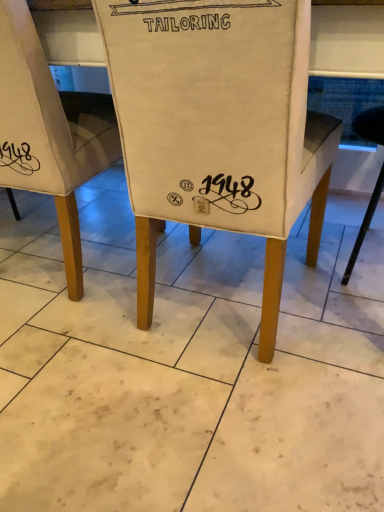
Describe the element at coordinates (49, 132) in the screenshot. The height and width of the screenshot is (512, 384). I see `white fabric chair at center, which is the 2th chair in right-to-left order` at that location.

I want to click on white fabric chair at center, which is the 2th chair in right-to-left order, so click(49, 132).

At what (x,y) coordinates should I click in order to perform the action: click on canvas chair at center, which is the second chair from left to right. Please return your answer as a coordinate pair (x, y). Image resolution: width=384 pixels, height=512 pixels. Looking at the image, I should click on (218, 128).

This screenshot has height=512, width=384. What do you see at coordinates (218, 128) in the screenshot?
I see `canvas chair at center, marked as the first chair in a right-to-left arrangement` at bounding box center [218, 128].

Find the location of a particular element. The height and width of the screenshot is (512, 384). white fabric chair at center, which is the 2th chair in right-to-left order is located at coordinates (49, 132).

Between canvas chair at center, which is the second chair from left to right, and white fabric chair at center, which is the 2th chair in right-to-left order, which one appears on the right side from the viewer's perspective?

From the viewer's perspective, canvas chair at center, which is the second chair from left to right, appears more on the right side.

Is the position of canvas chair at center, which is the second chair from left to right, less distant than that of white fabric chair at center, the 1th chair viewed from the left?

That is True.

Is point (228, 70) positioned in front of point (73, 188)?

Yes.

From the image's perspective, which is below, canvas chair at center, which is the second chair from left to right, or white fabric chair at center, which is the 2th chair in right-to-left order?

canvas chair at center, which is the second chair from left to right.

From a real-world perspective, is canvas chair at center, which is the second chair from left to right, below white fabric chair at center, the 1th chair viewed from the left?

Correct, in the physical world, canvas chair at center, which is the second chair from left to right, is lower than white fabric chair at center, the 1th chair viewed from the left.

Looking at their sizes, would you say canvas chair at center, marked as the first chair in a right-to-left arrangement, is wider or thinner than white fabric chair at center, which is the 2th chair in right-to-left order?

canvas chair at center, marked as the first chair in a right-to-left arrangement, is wider than white fabric chair at center, which is the 2th chair in right-to-left order.

Is canvas chair at center, which is the second chair from left to right, shorter than white fabric chair at center, which is the 2th chair in right-to-left order?

Correct, canvas chair at center, which is the second chair from left to right, is not as tall as white fabric chair at center, which is the 2th chair in right-to-left order.

Looking at this image, considering the sizes of canvas chair at center, marked as the first chair in a right-to-left arrangement, and white fabric chair at center, the 1th chair viewed from the left, in the image, is canvas chair at center, marked as the first chair in a right-to-left arrangement, bigger or smaller than white fabric chair at center, the 1th chair viewed from the left,?

canvas chair at center, marked as the first chair in a right-to-left arrangement, is bigger than white fabric chair at center, the 1th chair viewed from the left.

Consider the image. Is canvas chair at center, marked as the first chair in a right-to-left arrangement, completely or partially outside of white fabric chair at center, the 1th chair viewed from the left?

canvas chair at center, marked as the first chair in a right-to-left arrangement, lies outside white fabric chair at center, the 1th chair viewed from the left,'s area.

Is canvas chair at center, marked as the first chair in a right-to-left arrangement, beside white fabric chair at center, the 1th chair viewed from the left?

No, canvas chair at center, marked as the first chair in a right-to-left arrangement, is not next to white fabric chair at center, the 1th chair viewed from the left.

Is canvas chair at center, which is the second chair from left to right, facing towards white fabric chair at center, which is the 2th chair in right-to-left order?

No, canvas chair at center, which is the second chair from left to right, is not oriented towards white fabric chair at center, which is the 2th chair in right-to-left order.

Could you measure the distance between canvas chair at center, marked as the first chair in a right-to-left arrangement, and white fabric chair at center, the 1th chair viewed from the left?

canvas chair at center, marked as the first chair in a right-to-left arrangement, is 14.99 inches away from white fabric chair at center, the 1th chair viewed from the left.

Identify the location of chair located underneath the white fabric chair at center, the 1th chair viewed from the left (from a real-world perspective). (218, 128).

Considering the positions of objects white fabric chair at center, the 1th chair viewed from the left, and canvas chair at center, marked as the first chair in a right-to-left arrangement, in the image provided, who is more to the right, white fabric chair at center, the 1th chair viewed from the left, or canvas chair at center, marked as the first chair in a right-to-left arrangement,?

From the viewer's perspective, canvas chair at center, marked as the first chair in a right-to-left arrangement, appears more on the right side.

Does white fabric chair at center, which is the 2th chair in right-to-left order, come in front of canvas chair at center, marked as the first chair in a right-to-left arrangement?

No.

Is point (18, 113) closer or farther from the camera than point (255, 9)?

Clearly, point (18, 113) is more distant from the camera than point (255, 9).

From the image's perspective, is white fabric chair at center, which is the 2th chair in right-to-left order, located above or below canvas chair at center, marked as the first chair in a right-to-left arrangement?

From the image's perspective, white fabric chair at center, which is the 2th chair in right-to-left order, appears above canvas chair at center, marked as the first chair in a right-to-left arrangement.

From a real-world perspective, relative to canvas chair at center, marked as the first chair in a right-to-left arrangement, is white fabric chair at center, the 1th chair viewed from the left, vertically above or below?

Clearly, from a real-world perspective, white fabric chair at center, the 1th chair viewed from the left, is above canvas chair at center, marked as the first chair in a right-to-left arrangement.

In the scene shown: Between white fabric chair at center, the 1th chair viewed from the left, and canvas chair at center, which is the second chair from left to right, which one has smaller width?

Thinner between the two is white fabric chair at center, the 1th chair viewed from the left.

Which of these two, white fabric chair at center, the 1th chair viewed from the left, or canvas chair at center, which is the second chair from left to right, stands shorter?

With less height is canvas chair at center, which is the second chair from left to right.

In terms of size, does white fabric chair at center, which is the 2th chair in right-to-left order, appear bigger or smaller than canvas chair at center, which is the second chair from left to right?

Considering their sizes, white fabric chair at center, which is the 2th chair in right-to-left order, takes up less space than canvas chair at center, which is the second chair from left to right.

Would you say canvas chair at center, marked as the first chair in a right-to-left arrangement, is part of white fabric chair at center, which is the 2th chair in right-to-left order,'s contents?

Definitely not — canvas chair at center, marked as the first chair in a right-to-left arrangement, is not inside white fabric chair at center, which is the 2th chair in right-to-left order.

Is white fabric chair at center, the 1th chair viewed from the left, far away from canvas chair at center, which is the second chair from left to right?

Actually, white fabric chair at center, the 1th chair viewed from the left, and canvas chair at center, which is the second chair from left to right, are a little close together.

Is white fabric chair at center, the 1th chair viewed from the left, positioned with its back to canvas chair at center, marked as the first chair in a right-to-left arrangement?

No, white fabric chair at center, the 1th chair viewed from the left, is not facing the opposite direction of canvas chair at center, marked as the first chair in a right-to-left arrangement.

Could you measure the distance between white fabric chair at center, the 1th chair viewed from the left, and canvas chair at center, which is the second chair from left to right?

white fabric chair at center, the 1th chair viewed from the left, and canvas chair at center, which is the second chair from left to right, are 14.99 inches apart from each other.

What are the coordinates of `chair in front of the white fabric chair at center, the 1th chair viewed from the left` in the screenshot? It's located at (218, 128).

Where is `chair that is above the canvas chair at center, marked as the first chair in a right-to-left arrangement (from the image's perspective)`? Image resolution: width=384 pixels, height=512 pixels. chair that is above the canvas chair at center, marked as the first chair in a right-to-left arrangement (from the image's perspective) is located at coordinates (49, 132).

Locate an element on the screen. chair behind the canvas chair at center, which is the second chair from left to right is located at coordinates (49, 132).